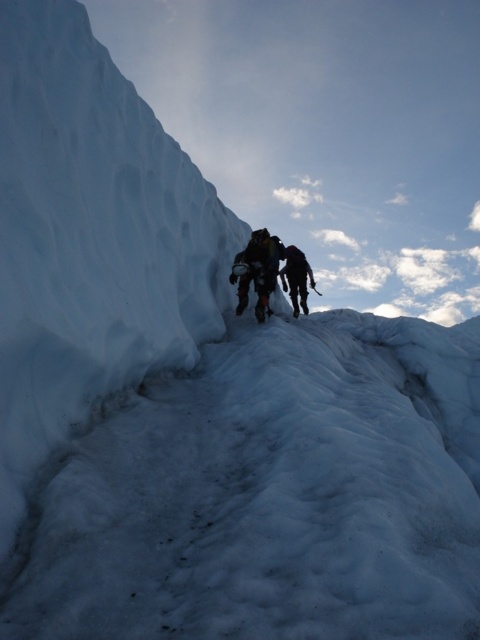
You are a climber trying to reach the summit. You notice the black fabric backpack at center and the dark gray fabric jacket at center. Which item is closer to the top of the slope?

The black fabric backpack at center is closer to the top of the slope because it is in front of the dark gray fabric jacket at center, indicating it is further along the path.

You are a photographer trying to capture the climbers on the icy slope. You notice the black fabric backpack at center and the dark gray fabric jacket at center. Which object is covering part of the other?

The black fabric backpack at center is positioned over the dark gray fabric jacket at center, so the backpack is covering part of the jacket.